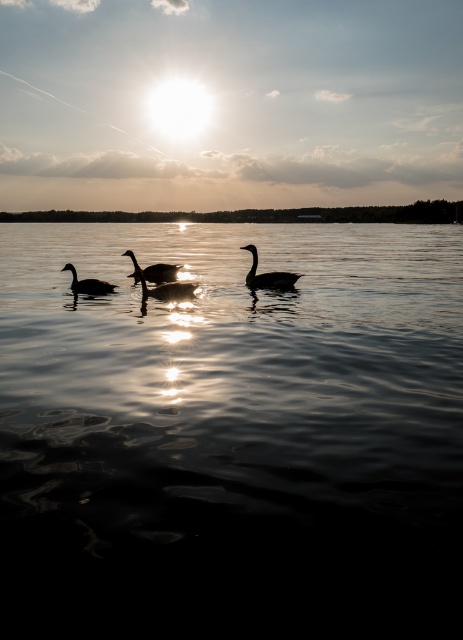
What do you see at coordinates (231, 435) in the screenshot?
I see `transparent water at center` at bounding box center [231, 435].

Can you confirm if transparent water at center is positioned below black matte goose at center?

Incorrect, transparent water at center is not positioned below black matte goose at center.

This screenshot has height=640, width=463. What do you see at coordinates (231, 435) in the screenshot? I see `transparent water at center` at bounding box center [231, 435].

This screenshot has height=640, width=463. Find the location of `transparent water at center`. transparent water at center is located at coordinates (231, 435).

Measure the distance between transparent water at center and camera.

transparent water at center is 7.72 feet away from camera.

Locate an element on the screen. The height and width of the screenshot is (640, 463). transparent water at center is located at coordinates (231, 435).

Between black matte goose at center and silvery glossy goose at center, which one appears on the left side from the viewer's perspective?

silvery glossy goose at center

Can you confirm if black matte goose at center is wider than silvery glossy goose at center?

Yes.

Does point (286, 284) come in front of point (142, 269)?

Yes.

This screenshot has width=463, height=640. What are the coordinates of `black matte goose at center` in the screenshot? It's located at (268, 275).